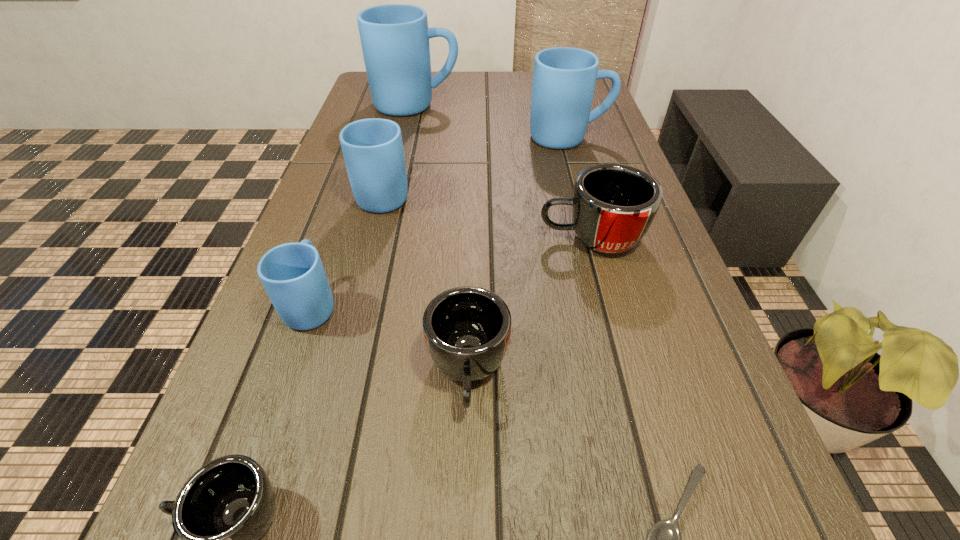
Choose which mug is the sixth nearest neighbor to the biggest blue mug. Please provide its 2D coordinates. Your answer should be formatted as a tuple, i.e. [(x, y)], where the tuple contains the x and y coordinates of a point satisfying the conditions above.

[(220, 514)]

Identify which mug is located as the fourth nearest to the nearest mug. Please provide its 2D coordinates. Your answer should be formatted as a tuple, i.e. [(x, y)], where the tuple contains the x and y coordinates of a point satisfying the conditions above.

[(372, 148)]

Identify which blue mug is the third nearest to the tallest mug. Please provide its 2D coordinates. Your answer should be formatted as a tuple, i.e. [(x, y)], where the tuple contains the x and y coordinates of a point satisfying the conditions above.

[(293, 275)]

You are a GUI agent. You are given a task and a screenshot of the screen. Output one action in this format:
    pyautogui.click(x=<x>, y=<y>)
    Task: Click on the closest blue mug to the second smallest blue mug
    Image resolution: width=960 pixels, height=540 pixels.
    Given the screenshot: What is the action you would take?
    pyautogui.click(x=293, y=275)

You are a GUI agent. You are given a task and a screenshot of the screen. Output one action in this format:
    pyautogui.click(x=<x>, y=<y>)
    Task: Click on the red mug that stands as the closest to the biggest red mug
    
    Given the screenshot: What is the action you would take?
    pyautogui.click(x=467, y=329)

Identify the location of red mug that stands as the second closest to the soupspoon. (613, 205).

This screenshot has height=540, width=960. Find the location of `blank space that satisfies the following two spatial constraints: 1. on the side of the sixth shortest mug with the handle; 2. on the side of the second biggest red mug with the handle`. blank space that satisfies the following two spatial constraints: 1. on the side of the sixth shortest mug with the handle; 2. on the side of the second biggest red mug with the handle is located at coordinates (634, 371).

I want to click on blank space that satisfies the following two spatial constraints: 1. on the side of the seventh nearest object with the handle; 2. on the side of the second biggest red mug with the handle, so click(x=634, y=371).

Image resolution: width=960 pixels, height=540 pixels. I want to click on vacant space that satisfies the following two spatial constraints: 1. on the side of the second farthest mug with the handle; 2. on the side of the second smallest red mug with the handle, so click(634, 371).